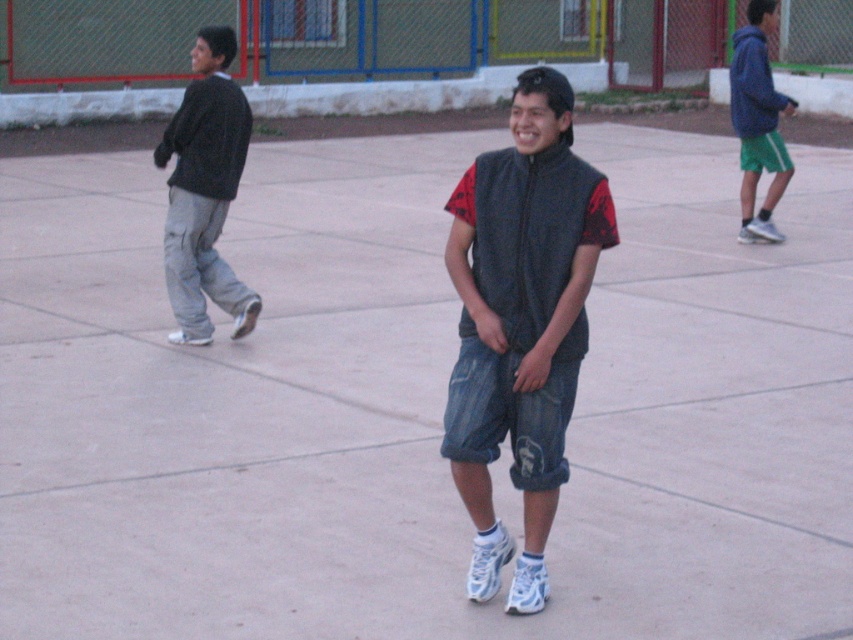
Question: Among these points, which one is nearest to the camera?

Choices:
 (A) pyautogui.click(x=525, y=257)
 (B) pyautogui.click(x=181, y=221)
 (C) pyautogui.click(x=761, y=52)

Answer: (A)

Question: Which object is closer to the camera taking this photo?

Choices:
 (A) green shorts at right
 (B) dark gray sweater at left
 (C) denim shorts at center

Answer: (C)

Question: Does denim shorts at center have a smaller size compared to green shorts at right?

Choices:
 (A) no
 (B) yes

Answer: (B)

Question: Is denim shorts at center closer to the viewer compared to dark gray sweater at left?

Choices:
 (A) yes
 (B) no

Answer: (A)

Question: Which point appears farthest from the camera in this image?

Choices:
 (A) (741, 86)
 (B) (172, 134)

Answer: (A)

Question: In this image, where is denim shorts at center located relative to green shorts at right?

Choices:
 (A) above
 (B) below

Answer: (B)